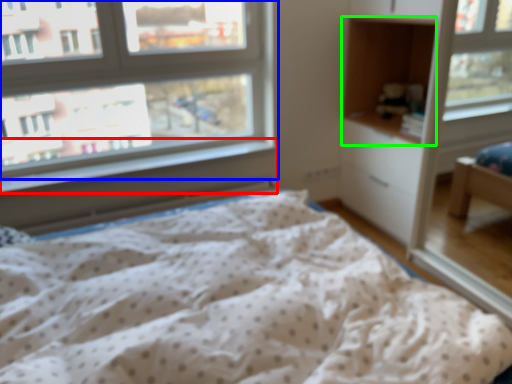
Question: Which is nearer to the window sill (highlighted by a red box)? window (highlighted by a blue box) or cabinet (highlighted by a green box).

Choices:
 (A) window
 (B) cabinet

Answer: (A)